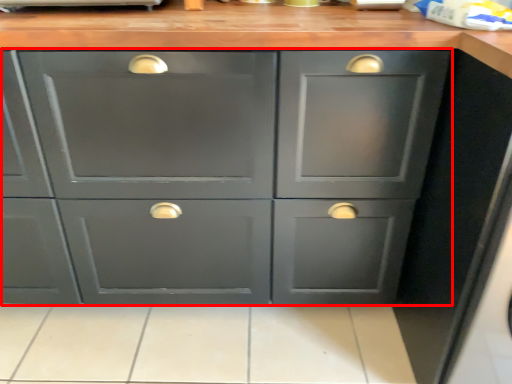
Question: Observing the image, what is the correct spatial positioning of cabinetry (annotated by the red box) in reference to tile?

Choices:
 (A) right
 (B) left

Answer: (B)